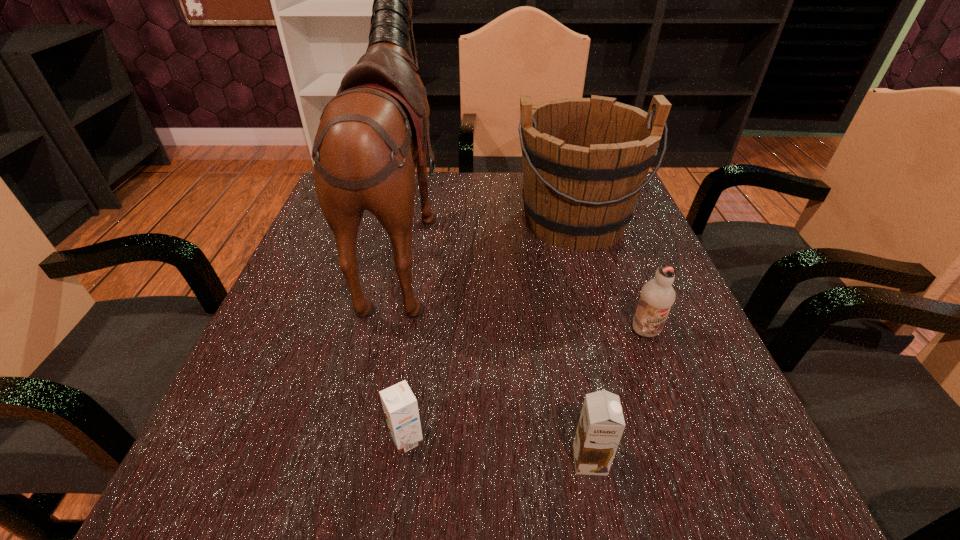
This screenshot has height=540, width=960. In the image, there is a desktop. What are the coordinates of `vacant region at the left edge` in the screenshot? It's located at (221, 439).

Where is `free space at the right edge of the desktop`? This screenshot has height=540, width=960. free space at the right edge of the desktop is located at coordinates (596, 262).

This screenshot has width=960, height=540. Find the location of `vacant space at the near left corner`. vacant space at the near left corner is located at coordinates (242, 513).

This screenshot has height=540, width=960. Identify the location of vacant space that's between the shortest chocolate milk and the tallest object. (406, 339).

Where is `free point between the shortest object and the rightmost chocolate milk`? free point between the shortest object and the rightmost chocolate milk is located at coordinates (526, 385).

Where is `free spot between the second tallest object and the farthest chocolate milk`? The image size is (960, 540). free spot between the second tallest object and the farthest chocolate milk is located at coordinates (611, 276).

Locate an element on the screen. free space between the tallest object and the fourth shortest object is located at coordinates (491, 230).

At what (x,y) coordinates should I click in order to perform the action: click on free space between the second chocolate milk from right to left and the shortest object. Please return your answer as a coordinate pair (x, y). The image size is (960, 540). Looking at the image, I should click on (498, 450).

Where is `unoccupied position between the farthest chocolate milk and the shortest object`? The height and width of the screenshot is (540, 960). unoccupied position between the farthest chocolate milk and the shortest object is located at coordinates (526, 385).

The image size is (960, 540). Identify the location of vacant space that's between the shortest object and the second chocolate milk from left to right. (498, 450).